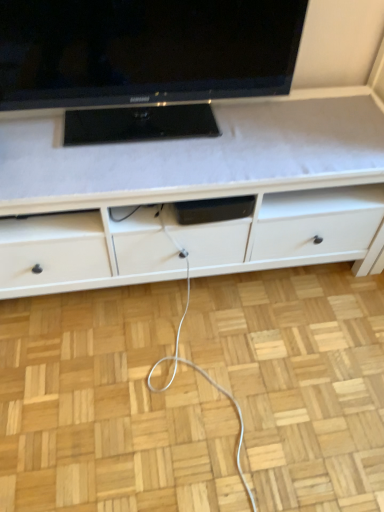
Question: Based on their sizes in the image, would you say white matte cabinet at center is bigger or smaller than black glossy tv at upper center?

Choices:
 (A) big
 (B) small

Answer: (A)

Question: From the image's perspective, is white matte cabinet at center positioned above or below black glossy tv at upper center?

Choices:
 (A) below
 (B) above

Answer: (A)

Question: Is white matte cabinet at center wider or thinner than black glossy tv at upper center?

Choices:
 (A) thin
 (B) wide

Answer: (B)

Question: From a real-world perspective, is black glossy tv at upper center above or below white matte cabinet at center?

Choices:
 (A) above
 (B) below

Answer: (A)

Question: In terms of height, does black glossy tv at upper center look taller or shorter compared to white matte cabinet at center?

Choices:
 (A) short
 (B) tall

Answer: (A)

Question: From the image's perspective, is black glossy tv at upper center above or below white matte cabinet at center?

Choices:
 (A) above
 (B) below

Answer: (A)

Question: Is black glossy tv at upper center bigger or smaller than white matte cabinet at center?

Choices:
 (A) small
 (B) big

Answer: (A)